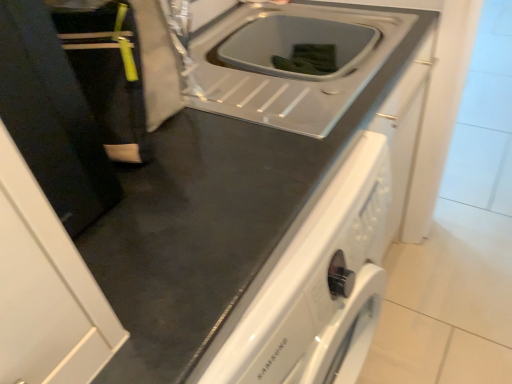
Question: Can you confirm if black fabric at left is wider than black matte door at left?

Choices:
 (A) yes
 (B) no

Answer: (B)

Question: Is black fabric at left not close to black matte door at left?

Choices:
 (A) no
 (B) yes

Answer: (A)

Question: Considering the relative sizes of black fabric at left and black matte door at left in the image provided, is black fabric at left thinner than black matte door at left?

Choices:
 (A) yes
 (B) no

Answer: (A)

Question: Can black matte door at left be found inside black fabric at left?

Choices:
 (A) yes
 (B) no

Answer: (B)

Question: Considering the relative sizes of black fabric at left and black matte door at left in the image provided, is black fabric at left shorter than black matte door at left?

Choices:
 (A) yes
 (B) no

Answer: (A)

Question: Could you tell me if black fabric at left is facing black matte door at left?

Choices:
 (A) yes
 (B) no

Answer: (B)

Question: Does white glossy sink at center lie in front of black fabric at left?

Choices:
 (A) yes
 (B) no

Answer: (B)

Question: Can you confirm if white glossy sink at center is thinner than black fabric at left?

Choices:
 (A) yes
 (B) no

Answer: (B)

Question: From the image's perspective, is white glossy sink at center under black fabric at left?

Choices:
 (A) no
 (B) yes

Answer: (A)

Question: Does white glossy sink at center have a lesser height compared to black fabric at left?

Choices:
 (A) no
 (B) yes

Answer: (B)

Question: Considering the relative positions of white glossy sink at center and black fabric at left in the image provided, is white glossy sink at center to the left of black fabric at left from the viewer's perspective?

Choices:
 (A) yes
 (B) no

Answer: (B)

Question: Is black fabric at left a part of white glossy sink at center?

Choices:
 (A) yes
 (B) no

Answer: (B)

Question: Can you confirm if white glossy sink at center is shorter than black matte door at left?

Choices:
 (A) no
 (B) yes

Answer: (B)